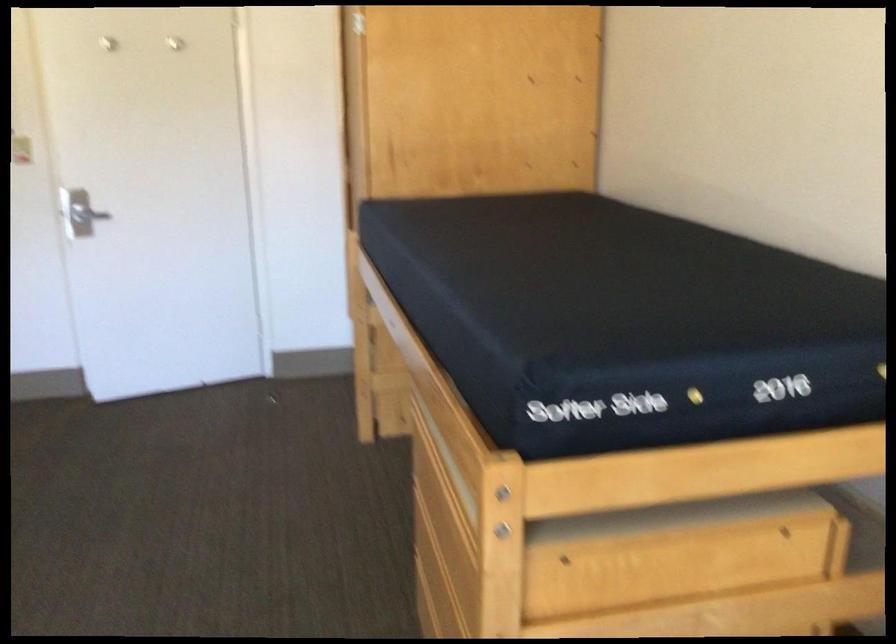
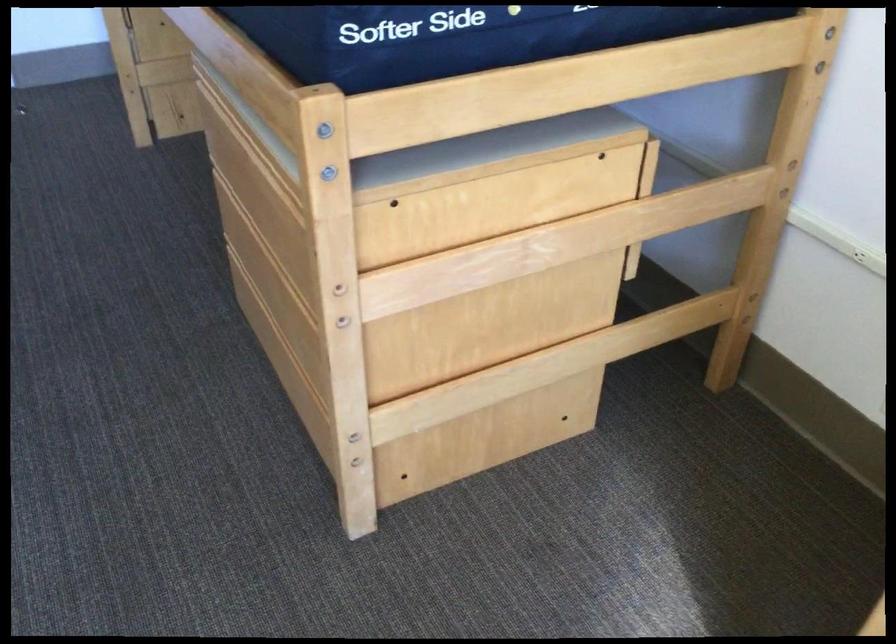
The images are taken continuously from a first-person perspective. In which direction are you moving?

The cameraman moved toward left, forward.